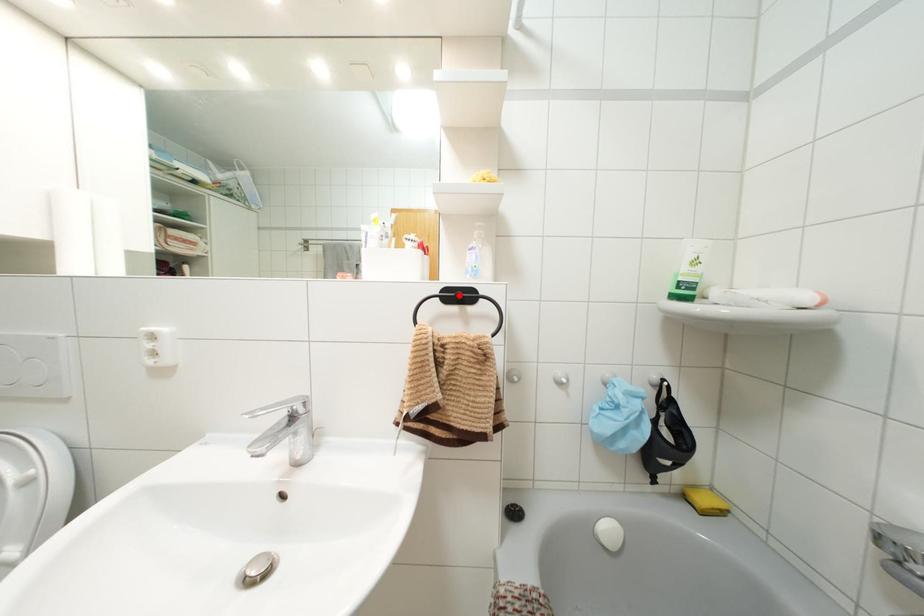
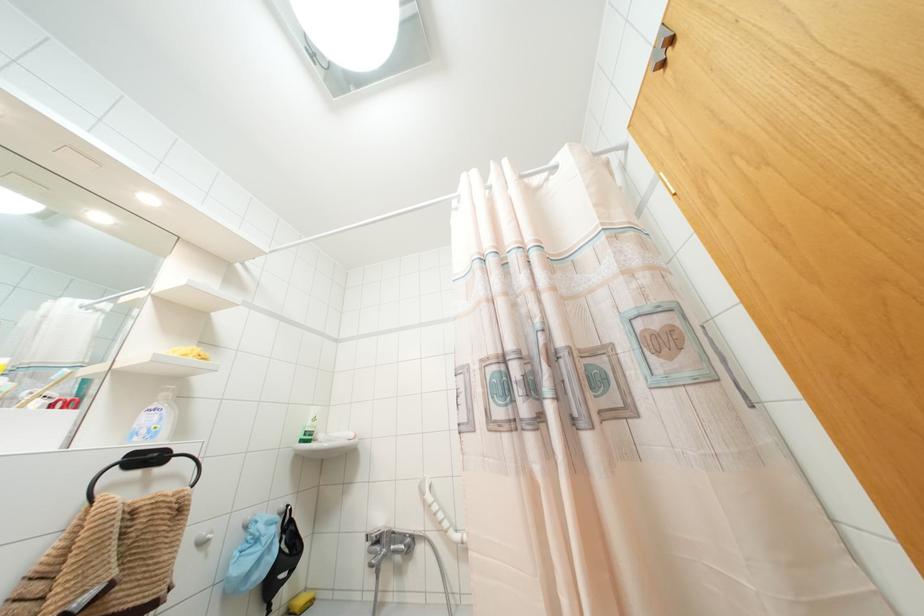
Locate, in the second image, the point that corresponds to the highlighted location in the first image.

(147, 458)